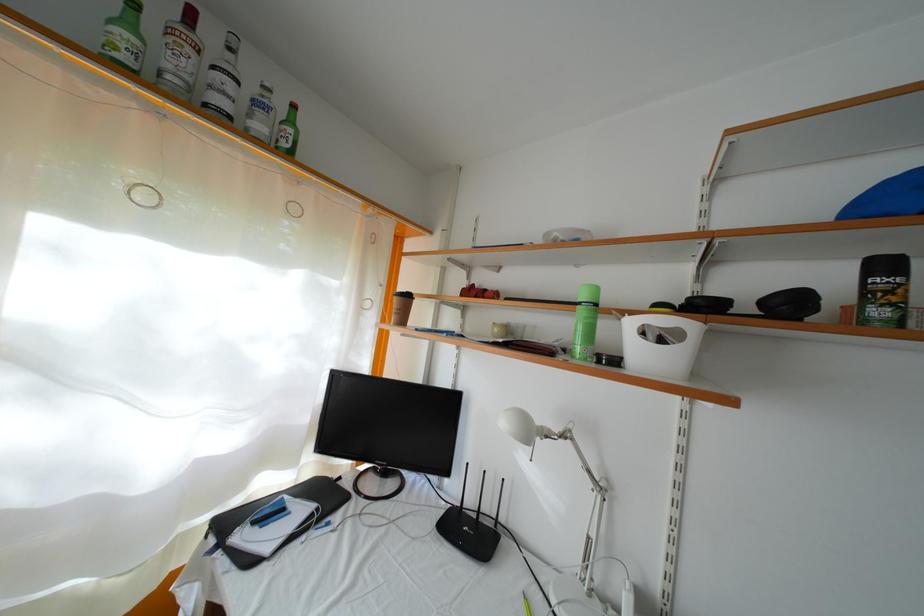
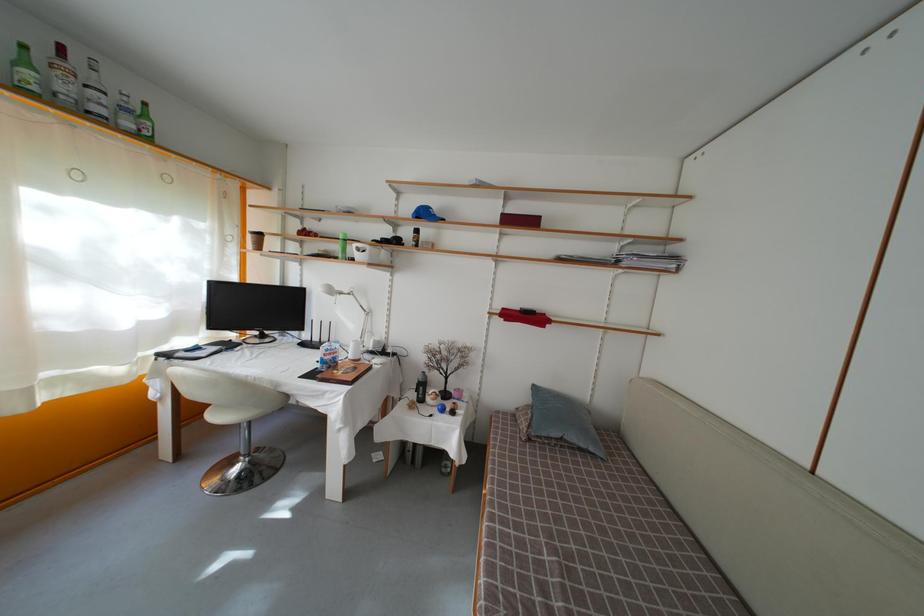
Where in the second image is the point corresponding to the point at 134,31 from the first image?

(31, 69)